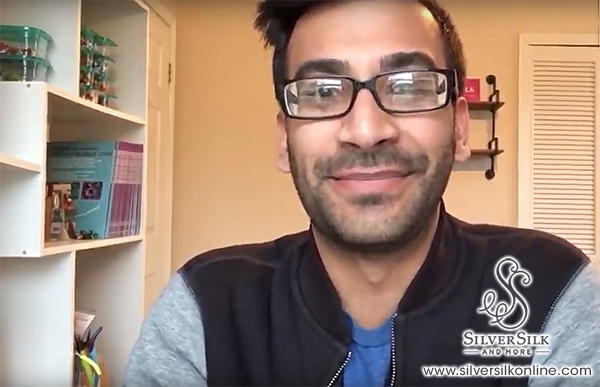
Identify the location of orange wall. (198, 155).